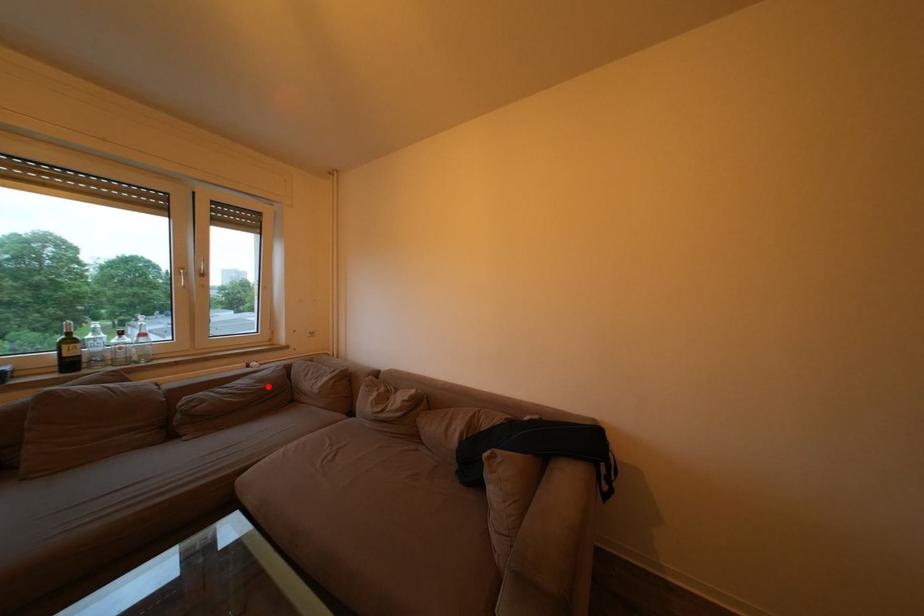
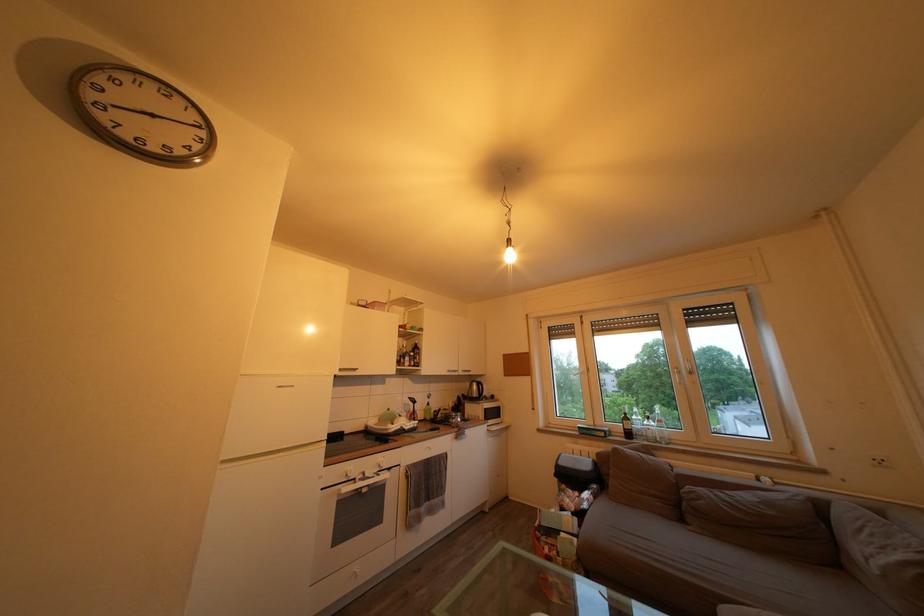
Question: I am providing you with two images of the same scene from different viewpoints. Image1 has a red point marked. In image2, the corresponding 3D location appears at what relative position? Reply with the corresponding letter.

Choices:
 (A) Closer
 (B) Farther

Answer: (A)